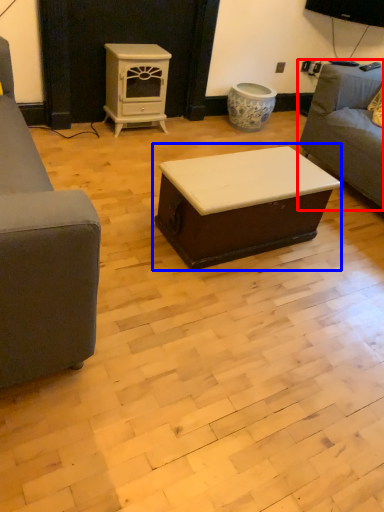
Question: Which object is further to the camera taking this photo, studio couch (highlighted by a red box) or table (highlighted by a blue box)?

Choices:
 (A) studio couch
 (B) table

Answer: (A)